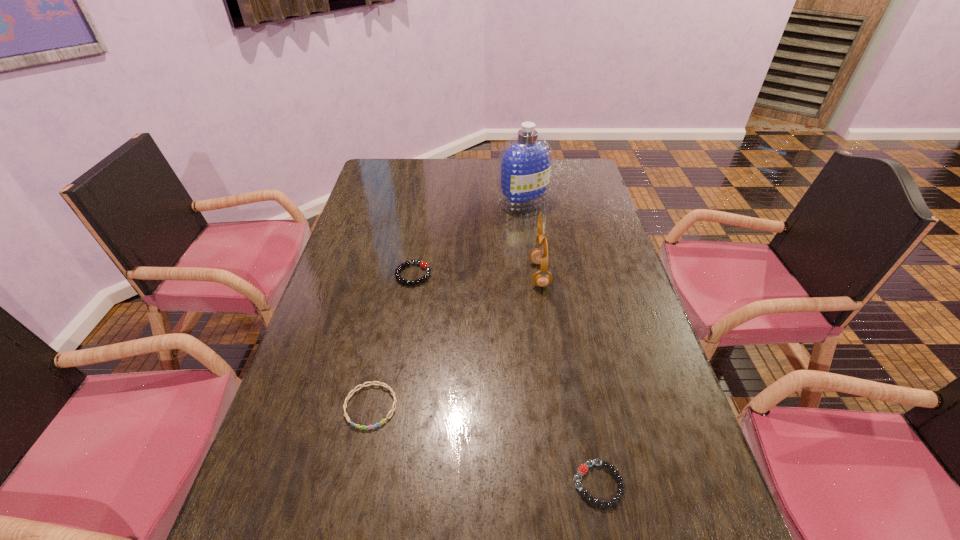
The height and width of the screenshot is (540, 960). Identify the location of free space between the earphone and the second farthest bracelet. tap(455, 340).

This screenshot has width=960, height=540. What are the coordinates of `unoccupied area between the nearest bracelet and the farthest object` in the screenshot? It's located at (561, 343).

You are a GUI agent. You are given a task and a screenshot of the screen. Output one action in this format:
    pyautogui.click(x=<x>, y=<y>)
    Task: Click on the free area in between the farthest bracelet and the second nearest bracelet
    
    Given the screenshot: What is the action you would take?
    pyautogui.click(x=392, y=340)

Where is `free area in between the second tallest object and the farthest object`? free area in between the second tallest object and the farthest object is located at coordinates (531, 238).

Find the location of a particular element. This screenshot has width=960, height=540. free spot between the second tallest object and the tallest object is located at coordinates (531, 238).

Where is `empty location between the nearest object and the earphone`? This screenshot has width=960, height=540. empty location between the nearest object and the earphone is located at coordinates (569, 379).

Where is `vacant space that is in between the rightmost bracelet and the farthest bracelet`? This screenshot has height=540, width=960. vacant space that is in between the rightmost bracelet and the farthest bracelet is located at coordinates (506, 379).

Where is `vacant point located between the nearest object and the tallest object`? vacant point located between the nearest object and the tallest object is located at coordinates (561, 343).

Image resolution: width=960 pixels, height=540 pixels. Find the location of `the second closest object to the earphone`. the second closest object to the earphone is located at coordinates (424, 265).

What are the coordinates of `object that is the closest to the farthest bracelet` in the screenshot? It's located at (539, 255).